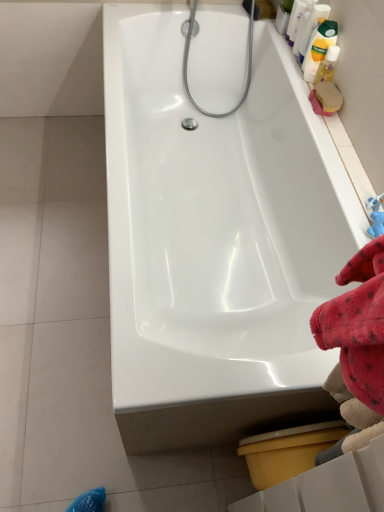
Question: Is white glossy bottle at upper right, marked as the 4th cleaning product in a bottom-to-top arrangement, at the right side of chrome metallic shower head at upper center?

Choices:
 (A) no
 (B) yes

Answer: (B)

Question: Is white glossy bottle at upper right, marked as the 4th cleaning product in a bottom-to-top arrangement, directly adjacent to chrome metallic shower head at upper center?

Choices:
 (A) yes
 (B) no

Answer: (B)

Question: Can you confirm if white glossy bottle at upper right, the 1th cleaning product viewed from the top, is positioned to the left of chrome metallic shower head at upper center?

Choices:
 (A) no
 (B) yes

Answer: (A)

Question: Considering the relative sizes of white glossy bottle at upper right, the 1th cleaning product viewed from the top, and chrome metallic shower head at upper center in the image provided, is white glossy bottle at upper right, the 1th cleaning product viewed from the top, shorter than chrome metallic shower head at upper center?

Choices:
 (A) yes
 (B) no

Answer: (A)

Question: Is white glossy bottle at upper right, the 1th cleaning product viewed from the top, thinner than chrome metallic shower head at upper center?

Choices:
 (A) yes
 (B) no

Answer: (A)

Question: Considering the positions of translucent plastic bottle at upper right, placed as the 2th cleaning product when sorted from top to bottom, and white glossy bathtub at center in the image, is translucent plastic bottle at upper right, placed as the 2th cleaning product when sorted from top to bottom, taller or shorter than white glossy bathtub at center?

Choices:
 (A) tall
 (B) short

Answer: (B)

Question: Which is correct: translucent plastic bottle at upper right, placed as the 2th cleaning product when sorted from top to bottom, is inside white glossy bathtub at center, or outside of it?

Choices:
 (A) inside
 (B) outside

Answer: (B)

Question: Is point (306, 31) positioned closer to the camera than point (289, 69)?

Choices:
 (A) farther
 (B) closer

Answer: (B)

Question: From the image's perspective, is translucent plastic bottle at upper right, which is the third cleaning product in bottom-to-top order, located above or below white glossy bathtub at center?

Choices:
 (A) below
 (B) above

Answer: (B)

Question: Is yellow plastic toilet bowl at lower right wider or thinner than chrome metallic shower head at upper center?

Choices:
 (A) thin
 (B) wide

Answer: (B)

Question: Is yellow plastic toilet bowl at lower right taller or shorter than chrome metallic shower head at upper center?

Choices:
 (A) short
 (B) tall

Answer: (A)

Question: Is yellow plastic toilet bowl at lower right in front of or behind chrome metallic shower head at upper center in the image?

Choices:
 (A) behind
 (B) front

Answer: (B)

Question: Is point (244, 439) positioned closer to the camera than point (183, 73)?

Choices:
 (A) farther
 (B) closer

Answer: (B)

Question: Considering their positions, is chrome metallic shower head at upper center located in front of or behind yellow matte bottle at upper right, which is counted as the 1th cleaning product, starting from the bottom?

Choices:
 (A) front
 (B) behind

Answer: (B)

Question: Would you say chrome metallic shower head at upper center is to the left or to the right of yellow matte bottle at upper right, which is counted as the 1th cleaning product, starting from the bottom, in the picture?

Choices:
 (A) left
 (B) right

Answer: (A)